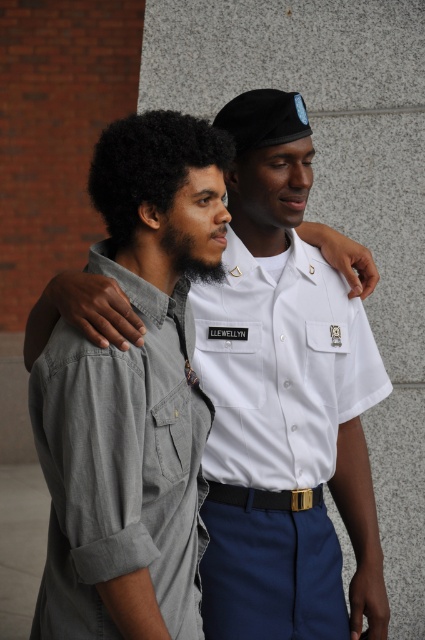
Question: Does dark curly hair at center have a smaller size compared to black leather belt at center?

Choices:
 (A) no
 (B) yes

Answer: (A)

Question: Considering the real-world distances, which object is closest to the dark curly hair at center?

Choices:
 (A) white smooth shirt at center
 (B) white cotton shirt at left
 (C) white uniform shirt at center
 (D) black leather belt at center

Answer: (B)

Question: Is white uniform shirt at center positioned in front of white cotton shirt at left?

Choices:
 (A) yes
 (B) no

Answer: (B)

Question: Among these points, which one is farthest from the camera?

Choices:
 (A) (302, 497)
 (B) (130, 237)
 (C) (124, 435)
 (D) (214, 636)

Answer: (A)

Question: Which object is positioned farthest from the black leather belt at center?

Choices:
 (A) dark curly hair at center
 (B) white smooth shirt at center
 (C) white uniform shirt at center
 (D) white cotton shirt at left

Answer: (A)

Question: Is dark curly hair at center thinner than black leather belt at center?

Choices:
 (A) no
 (B) yes

Answer: (A)